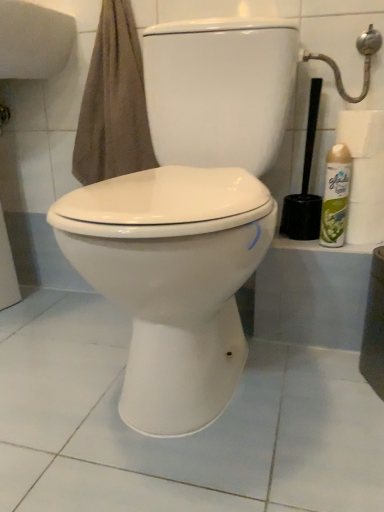
Question: Does white matte toilet paper at right, the second toilet paper ordered from the bottom, contain metallic silver showerhead at upper right?

Choices:
 (A) no
 (B) yes

Answer: (A)

Question: Is white matte toilet paper at right, which is the first toilet paper from top to bottom, oriented away from metallic silver showerhead at upper right?

Choices:
 (A) no
 (B) yes

Answer: (A)

Question: Is white matte toilet paper at right, which is the first toilet paper from top to bottom, positioned behind metallic silver showerhead at upper right?

Choices:
 (A) no
 (B) yes

Answer: (B)

Question: Are white matte toilet paper at right, the second toilet paper ordered from the bottom, and metallic silver showerhead at upper right beside each other?

Choices:
 (A) yes
 (B) no

Answer: (B)

Question: Considering the relative sizes of white matte toilet paper at right, which is the first toilet paper from top to bottom, and metallic silver showerhead at upper right in the image provided, is white matte toilet paper at right, which is the first toilet paper from top to bottom, bigger than metallic silver showerhead at upper right?

Choices:
 (A) no
 (B) yes

Answer: (A)

Question: Based on their sizes in the image, would you say white glossy toilet at center is bigger or smaller than metallic silver showerhead at upper right?

Choices:
 (A) small
 (B) big

Answer: (B)

Question: Is white glossy toilet at center spatially inside metallic silver showerhead at upper right, or outside of it?

Choices:
 (A) inside
 (B) outside

Answer: (B)

Question: From the image's perspective, is white glossy toilet at center located above or below metallic silver showerhead at upper right?

Choices:
 (A) below
 (B) above

Answer: (A)

Question: From a real-world perspective, is white glossy toilet at center physically located above or below metallic silver showerhead at upper right?

Choices:
 (A) below
 (B) above

Answer: (A)

Question: In terms of width, does white glossy toilet paper at right, arranged as the second toilet paper when viewed from the top, look wider or thinner when compared to white matte toilet paper at right, which is the first toilet paper from top to bottom?

Choices:
 (A) thin
 (B) wide

Answer: (A)

Question: Relative to white matte toilet paper at right, the second toilet paper ordered from the bottom, is white glossy toilet paper at right, the first toilet paper from the bottom, in front or behind?

Choices:
 (A) front
 (B) behind

Answer: (B)

Question: Considering the positions of white glossy toilet paper at right, the first toilet paper from the bottom, and white matte toilet paper at right, the second toilet paper ordered from the bottom, in the image, is white glossy toilet paper at right, the first toilet paper from the bottom, taller or shorter than white matte toilet paper at right, the second toilet paper ordered from the bottom,?

Choices:
 (A) short
 (B) tall

Answer: (A)

Question: From a real-world perspective, is white glossy toilet paper at right, the first toilet paper from the bottom, physically located above or below white matte toilet paper at right, the second toilet paper ordered from the bottom?

Choices:
 (A) below
 (B) above

Answer: (A)

Question: From the image's perspective, is white matte toilet paper at right, which is the first toilet paper from top to bottom, above or below white glossy toilet at center?

Choices:
 (A) below
 (B) above

Answer: (B)

Question: Relative to white glossy toilet at center, is white matte toilet paper at right, which is the first toilet paper from top to bottom, in front or behind?

Choices:
 (A) behind
 (B) front

Answer: (A)